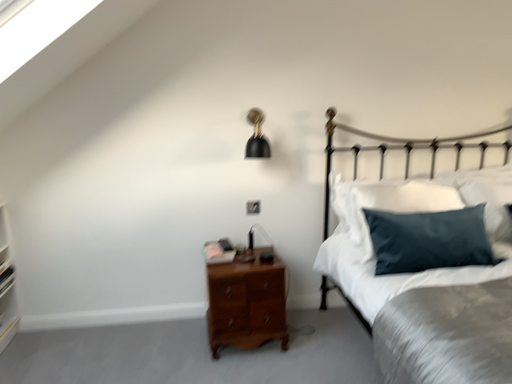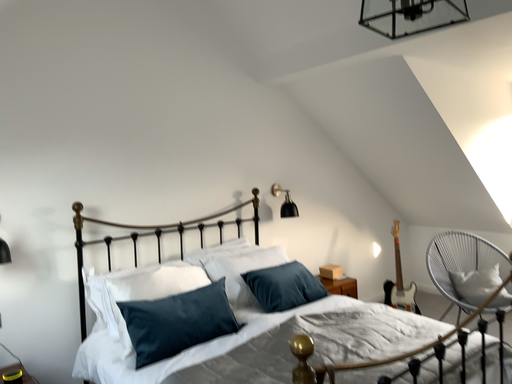
Question: Which way did the camera rotate in the video?

Choices:
 (A) rotated downward
 (B) rotated upward

Answer: (B)